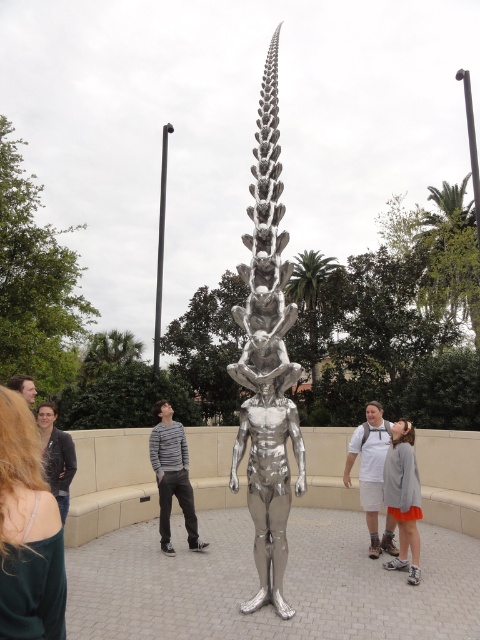
Can you confirm if striped sweater at center is positioned to the left of white matte shirt at center?

Indeed, striped sweater at center is positioned on the left side of white matte shirt at center.

Which is more to the right, striped sweater at center or white matte shirt at center?

white matte shirt at center is more to the right.

Which is in front, point (182, 449) or point (372, 420)?

Point (182, 449) is more forward.

You are a GUI agent. You are given a task and a screenshot of the screen. Output one action in this format:
    pyautogui.click(x=<x>, y=<y>)
    Task: Click on the striped sweater at center
    This screenshot has width=480, height=640.
    Given the screenshot: What is the action you would take?
    pyautogui.click(x=171, y=476)

Is green fabric dress at lower left below matte black hair at upper left?

Correct, green fabric dress at lower left is located below matte black hair at upper left.

This screenshot has height=640, width=480. In order to click on green fabric dress at lower left in this screenshot , I will do `click(27, 531)`.

Can you confirm if green fabric dress at lower left is positioned above gray sweater at center?

Indeed, green fabric dress at lower left is positioned over gray sweater at center.

Can you confirm if green fabric dress at lower left is taller than gray sweater at center?

No.

Locate an element on the screen. green fabric dress at lower left is located at coordinates (27, 531).